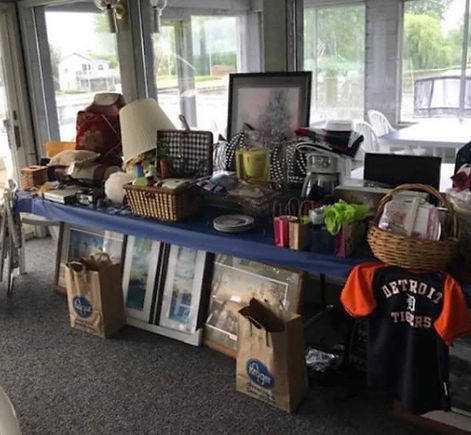
Find the location of a particular element. This screenshot has height=435, width=471. pictures is located at coordinates (143, 267), (179, 283), (243, 293), (96, 239), (258, 112).